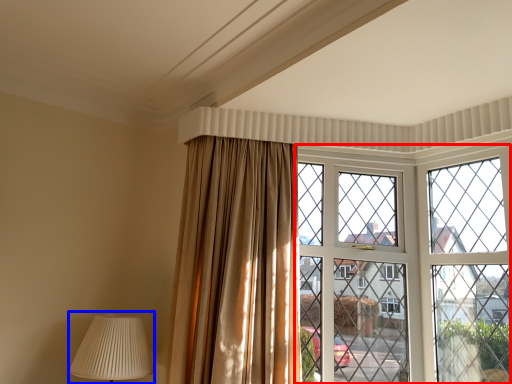
Question: Which point is further to the camera, window (highlighted by a red box) or table lamp (highlighted by a blue box)?

Choices:
 (A) window
 (B) table lamp

Answer: (A)